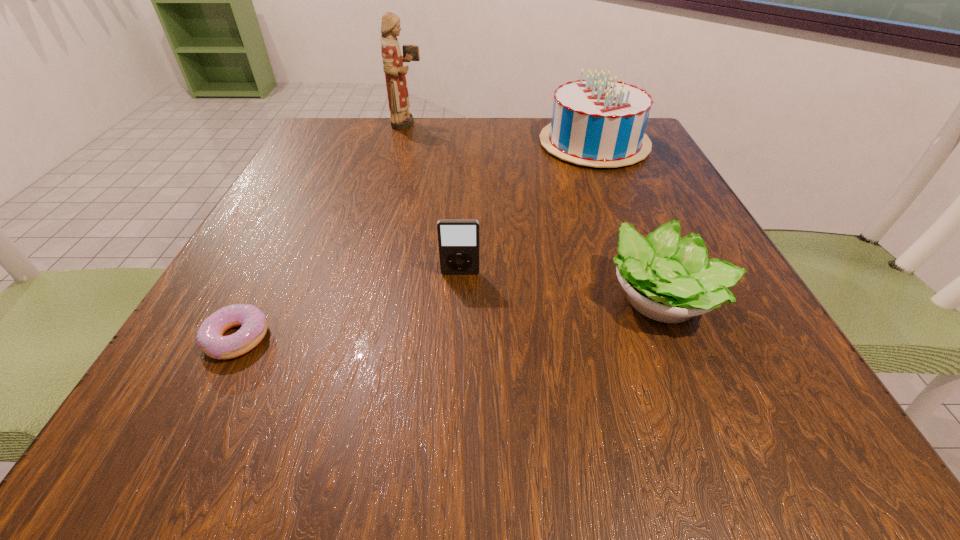
This screenshot has height=540, width=960. I want to click on figurine, so click(x=400, y=117).

This screenshot has height=540, width=960. I want to click on the tallest object, so click(400, 117).

Where is `the fourth shortest object`? the fourth shortest object is located at coordinates pyautogui.click(x=599, y=123).

Identify the location of the third object from left to right. The height and width of the screenshot is (540, 960). (458, 240).

At what (x,y) coordinates should I click in order to perform the action: click on lettuce. Please return your answer as a coordinate pair (x, y). Looking at the image, I should click on (669, 279).

What are the coordinates of `doughnut` in the screenshot? It's located at (210, 339).

Locate an element on the screen. This screenshot has width=960, height=540. the shortest object is located at coordinates (210, 339).

Where is `free location located 0.140m on the front-facing side of the tallest object`? The image size is (960, 540). free location located 0.140m on the front-facing side of the tallest object is located at coordinates point(479,124).

The width and height of the screenshot is (960, 540). I want to click on vacant area situated 0.300m on the front of the second tallest object, so click(643, 262).

Locate an element on the screen. The height and width of the screenshot is (540, 960). vacant space located on the front-facing side of the iPod is located at coordinates (x=455, y=369).